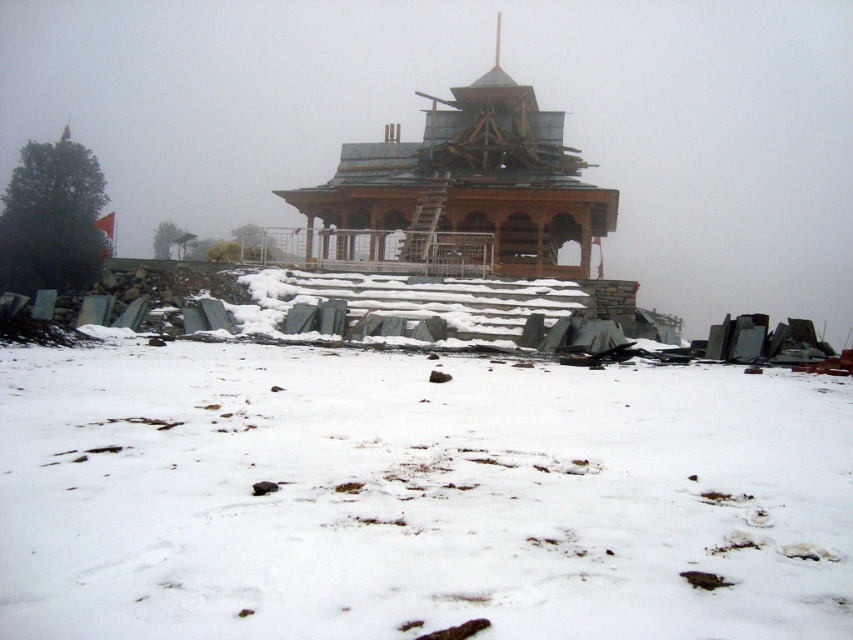
Who is lower down, white powdery snow at center or wooden temple at center?

Positioned lower is white powdery snow at center.

Is white powdery snow at center below wooden temple at center?

Yes.

What do you see at coordinates (415, 496) in the screenshot? I see `white powdery snow at center` at bounding box center [415, 496].

In order to click on white powdery snow at center in this screenshot , I will do [415, 496].